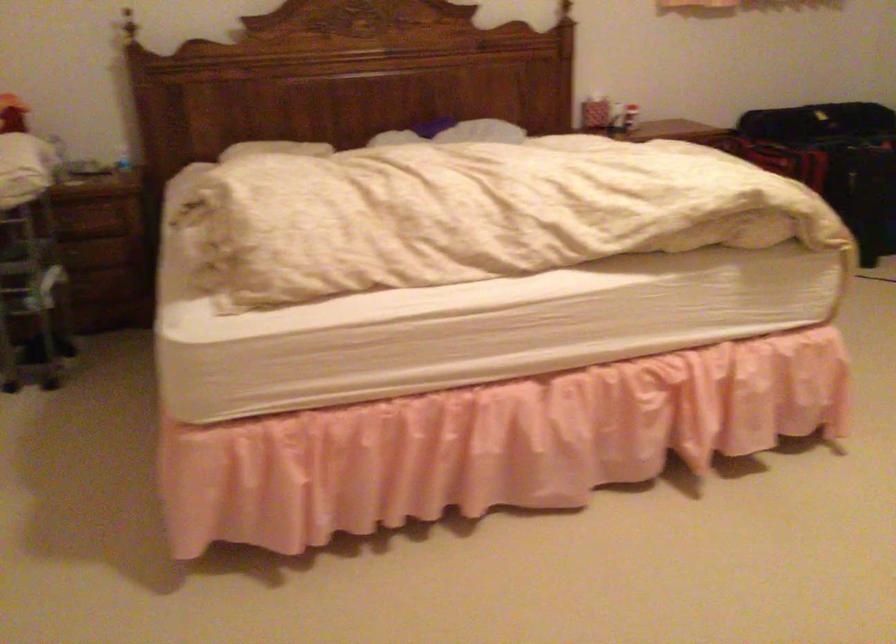
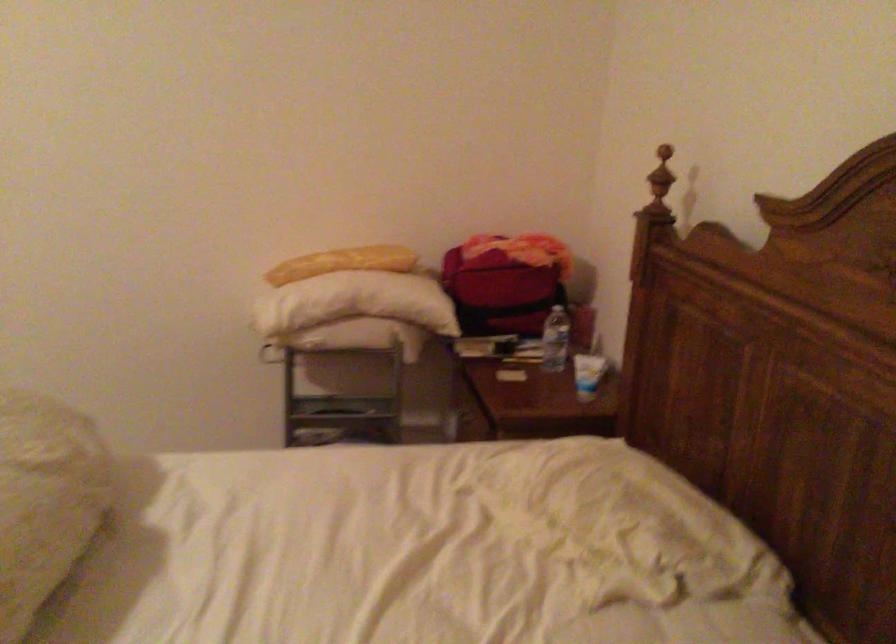
In the second image, find the point that corresponds to (73,138) in the first image.

(556, 339)